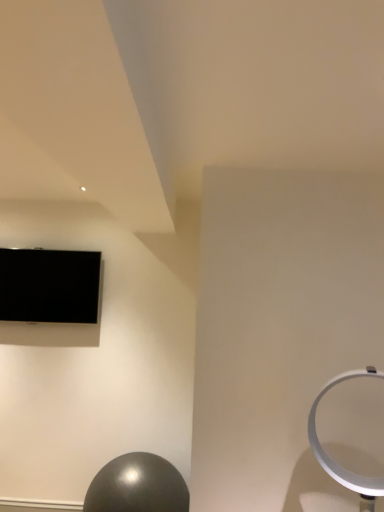
Describe the element at coordinates (137, 486) in the screenshot. I see `shiny metallic ball at lower left` at that location.

You are a GUI agent. You are given a task and a screenshot of the screen. Output one action in this format:
    pyautogui.click(x=<x>, y=<y>)
    Task: Click on the shiny metallic ball at lower left
    
    Given the screenshot: What is the action you would take?
    pyautogui.click(x=137, y=486)

What do you see at coordinates (49, 286) in the screenshot?
I see `black glossy tv at upper left` at bounding box center [49, 286].

The image size is (384, 512). In order to click on black glossy tv at upper left in this screenshot , I will do `click(49, 286)`.

Identify the location of shiny metallic ball at lower left. (137, 486).

Which is more to the right, shiny metallic ball at lower left or black glossy tv at upper left?

shiny metallic ball at lower left.

Considering their positions, is shiny metallic ball at lower left located in front of or behind black glossy tv at upper left?

shiny metallic ball at lower left is positioned closer to the viewer than black glossy tv at upper left.

Which is farther from the camera, (147, 480) or (11, 261)?

The point (11, 261) is farther from the camera.

From the image's perspective, between shiny metallic ball at lower left and black glossy tv at upper left, which one is located above?

black glossy tv at upper left, from the image's perspective.

From a real-world perspective, is shiny metallic ball at lower left physically located above or below black glossy tv at upper left?

From a real-world perspective, shiny metallic ball at lower left is physically below black glossy tv at upper left.

Can you confirm if shiny metallic ball at lower left is wider than black glossy tv at upper left?

Correct, the width of shiny metallic ball at lower left exceeds that of black glossy tv at upper left.

Considering the sizes of shiny metallic ball at lower left and black glossy tv at upper left in the image, is shiny metallic ball at lower left taller or shorter than black glossy tv at upper left?

shiny metallic ball at lower left is shorter than black glossy tv at upper left.

From the picture: Can you confirm if shiny metallic ball at lower left is bigger than black glossy tv at upper left?

Correct, shiny metallic ball at lower left is larger in size than black glossy tv at upper left.

In the scene shown: Is black glossy tv at upper left a part of shiny metallic ball at lower left?

No, black glossy tv at upper left is not surrounded by shiny metallic ball at lower left.

Is shiny metallic ball at lower left next to black glossy tv at upper left?

shiny metallic ball at lower left and black glossy tv at upper left are not in contact.

Is shiny metallic ball at lower left aimed at black glossy tv at upper left?

No, shiny metallic ball at lower left is not facing towards black glossy tv at upper left.

Can you tell me how much shiny metallic ball at lower left and black glossy tv at upper left differ in facing direction?

There is a 1.16-degree angle between the facing directions of shiny metallic ball at lower left and black glossy tv at upper left.

Where is `television that appears on the left of shiny metallic ball at lower left`? This screenshot has width=384, height=512. television that appears on the left of shiny metallic ball at lower left is located at coordinates (49, 286).

Does black glossy tv at upper left appear on the left side of shiny metallic ball at lower left?

Indeed, black glossy tv at upper left is positioned on the left side of shiny metallic ball at lower left.

Which is behind, black glossy tv at upper left or shiny metallic ball at lower left?

black glossy tv at upper left is further from the camera.

Considering the points (1, 275) and (126, 493), which point is behind, point (1, 275) or point (126, 493)?

Positioned behind is point (1, 275).

In the scene shown: From the image's perspective, between black glossy tv at upper left and shiny metallic ball at lower left, which one is located above?

From the image's view, black glossy tv at upper left is above.

From a real-world perspective, relative to shiny metallic ball at lower left, is black glossy tv at upper left vertically above or below?

black glossy tv at upper left is above shiny metallic ball at lower left.

Between black glossy tv at upper left and shiny metallic ball at lower left, which one has larger width?

With larger width is shiny metallic ball at lower left.

Can you confirm if black glossy tv at upper left is shorter than shiny metallic ball at lower left?

No.

Considering the relative sizes of black glossy tv at upper left and shiny metallic ball at lower left in the image provided, is black glossy tv at upper left smaller than shiny metallic ball at lower left?

Indeed, black glossy tv at upper left has a smaller size compared to shiny metallic ball at lower left.

Is black glossy tv at upper left inside the boundaries of shiny metallic ball at lower left, or outside?

black glossy tv at upper left exists outside the volume of shiny metallic ball at lower left.

Is black glossy tv at upper left next to shiny metallic ball at lower left?

No, black glossy tv at upper left is not beside shiny metallic ball at lower left.

Is black glossy tv at upper left facing towards shiny metallic ball at lower left?

No, black glossy tv at upper left does not turn towards shiny metallic ball at lower left.

What's the angular difference between black glossy tv at upper left and shiny metallic ball at lower left's facing directions?

The facing directions of black glossy tv at upper left and shiny metallic ball at lower left are 1.16 degrees apart.

How much distance is there between black glossy tv at upper left and shiny metallic ball at lower left?

They are 3.88 feet apart.

Locate an element on the screen. This screenshot has width=384, height=512. television above the shiny metallic ball at lower left (from the image's perspective) is located at coordinates (49, 286).

Image resolution: width=384 pixels, height=512 pixels. What are the coordinates of `ball in front of the black glossy tv at upper left` in the screenshot? It's located at 137,486.

Find the location of a particular element. television on the left of shiny metallic ball at lower left is located at coordinates (49, 286).